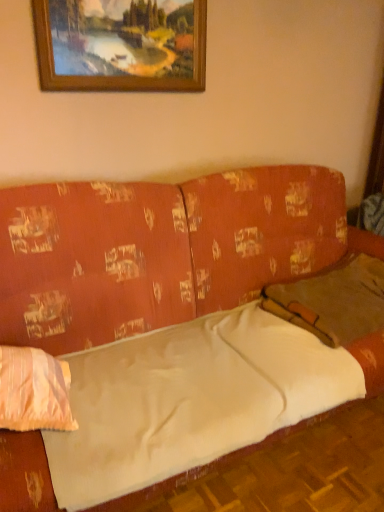
Question: From the image's perspective, would you say brown fabric pillow at right, the 2th pillow in the left-to-right sequence, is shown under light pink fabric pillow at left, positioned as the 2th pillow in right-to-left order?

Choices:
 (A) no
 (B) yes

Answer: (A)

Question: Can you confirm if brown fabric pillow at right, acting as the first pillow starting from the right, is smaller than light pink fabric pillow at left, positioned as the 2th pillow in right-to-left order?

Choices:
 (A) no
 (B) yes

Answer: (A)

Question: Is brown fabric pillow at right, acting as the first pillow starting from the right, completely or partially outside of light pink fabric pillow at left, positioned as the 2th pillow in right-to-left order?

Choices:
 (A) yes
 (B) no

Answer: (A)

Question: Is brown fabric pillow at right, arranged as the first pillow when viewed from the back, positioned behind light pink fabric pillow at left, which is counted as the 2th pillow, starting from the back?

Choices:
 (A) no
 (B) yes

Answer: (B)

Question: Is brown fabric pillow at right, acting as the first pillow starting from the right, bigger than light pink fabric pillow at left, placed as the 1th pillow when sorted from front to back?

Choices:
 (A) no
 (B) yes

Answer: (B)

Question: From the image's perspective, is textured orange couch at center positioned above or below brown fabric pillow at right, arranged as the 2th pillow when viewed from the front?

Choices:
 (A) below
 (B) above

Answer: (A)

Question: Considering the positions of point (31, 489) and point (362, 300), is point (31, 489) closer or farther from the camera than point (362, 300)?

Choices:
 (A) closer
 (B) farther

Answer: (A)

Question: Choose the correct answer: Is textured orange couch at center inside brown fabric pillow at right, arranged as the 2th pillow when viewed from the front, or outside it?

Choices:
 (A) outside
 (B) inside

Answer: (A)

Question: From a real-world perspective, is textured orange couch at center above or below brown fabric pillow at right, the 2th pillow in the left-to-right sequence?

Choices:
 (A) below
 (B) above

Answer: (A)

Question: Would you say wooden picture frame at upper center is inside or outside brown fabric pillow at right, arranged as the first pillow when viewed from the back?

Choices:
 (A) inside
 (B) outside

Answer: (B)

Question: In the image, is wooden picture frame at upper center positioned in front of or behind brown fabric pillow at right, arranged as the 2th pillow when viewed from the front?

Choices:
 (A) front
 (B) behind

Answer: (B)

Question: From a real-world perspective, is wooden picture frame at upper center positioned above or below brown fabric pillow at right, the 2th pillow in the left-to-right sequence?

Choices:
 (A) above
 (B) below

Answer: (A)

Question: Is wooden picture frame at upper center wider or thinner than brown fabric pillow at right, arranged as the 2th pillow when viewed from the front?

Choices:
 (A) thin
 (B) wide

Answer: (A)

Question: Do you think brown fabric pillow at right, arranged as the first pillow when viewed from the back, is within light pink fabric pillow at left, positioned as the 2th pillow in right-to-left order, or outside of it?

Choices:
 (A) outside
 (B) inside

Answer: (A)

Question: From the image's perspective, is brown fabric pillow at right, the 2th pillow in the left-to-right sequence, above or below light pink fabric pillow at left, placed as the 1th pillow when sorted from front to back?

Choices:
 (A) above
 (B) below

Answer: (A)